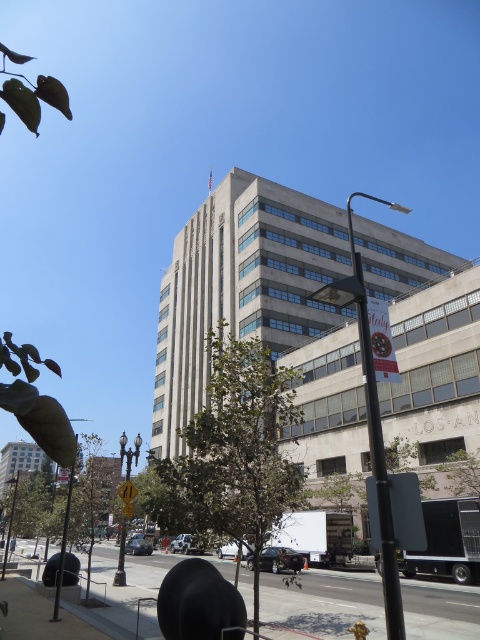
Question: Does green leafy tree at center appear on the left side of yellow reflective street sign at center?

Choices:
 (A) yes
 (B) no

Answer: (B)

Question: Which point is farther to the camera?

Choices:
 (A) (201, 481)
 (B) (118, 579)

Answer: (B)

Question: Which point is closer to the camera?

Choices:
 (A) (127, 515)
 (B) (88, 436)

Answer: (B)

Question: Among these points, which one is nearest to the camera?

Choices:
 (A) (228, 371)
 (B) (91, 451)

Answer: (A)

Question: Is green leafy tree at center to the right of green leafy tree at lower left from the viewer's perspective?

Choices:
 (A) yes
 (B) no

Answer: (A)

Question: From the image, what is the correct spatial relationship of green leafy tree at center in relation to yellow reflective street sign at center?

Choices:
 (A) right
 (B) left

Answer: (A)